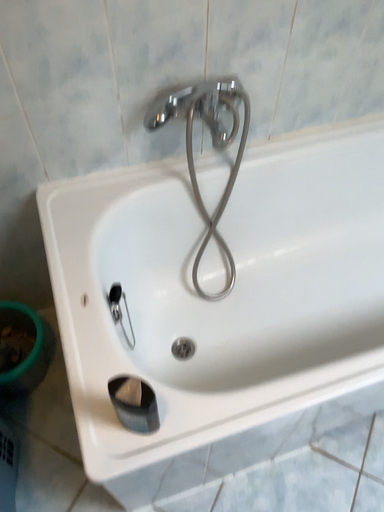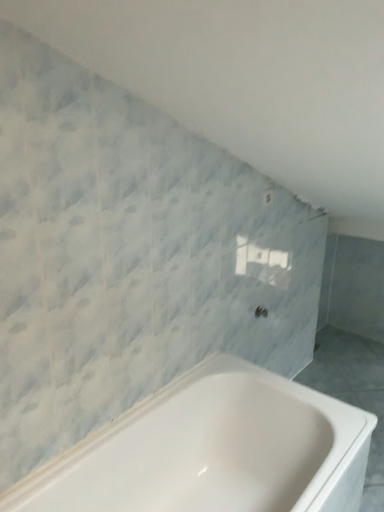
Question: Which way did the camera rotate in the video?

Choices:
 (A) rotated right
 (B) rotated left

Answer: (A)